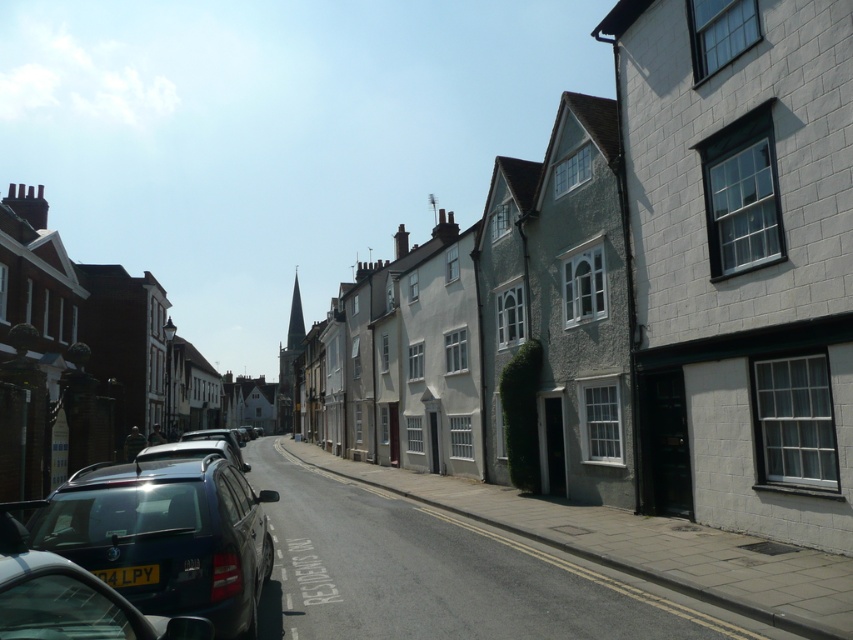
You are standing on the sidewalk and want to take a photo of the white brick building at center. If your camera has a focal length of 50mm and you want to capture the entire building in the frame, would you need to move closer or farther away?

The distance between you and the white brick building at center is 8.57 meters. To capture the entire building with a 50mm lens, you would need to stay at the current distance or move slightly closer, as 50mm lenses are considered standard and typically require being within 8 to 10 meters for full framing of structures this size.